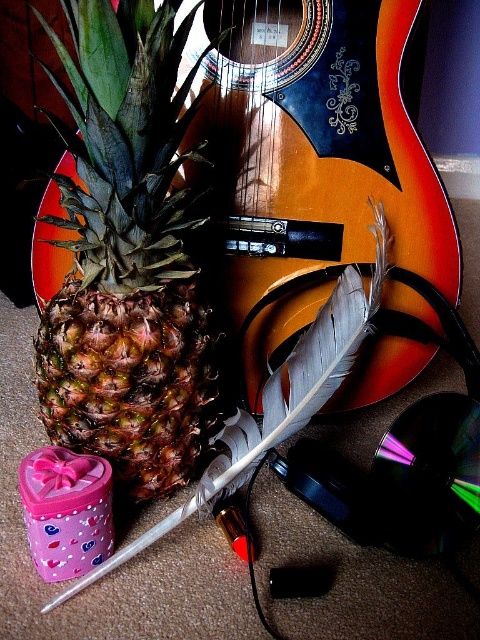
Question: Among these points, which one is farthest from the camera?

Choices:
 (A) (264, 378)
 (B) (162, 321)

Answer: (A)

Question: Which point is farther from the camera taking this photo?

Choices:
 (A) (108, 28)
 (B) (363, 257)

Answer: (B)

Question: Is glossy wood guitar at upper center to the right of brown rough pineapple at center from the viewer's perspective?

Choices:
 (A) yes
 (B) no

Answer: (A)

Question: Among these points, which one is farthest from the camera?

Choices:
 (A) (248, 156)
 (B) (163, 77)

Answer: (A)

Question: Is the position of glossy wood guitar at upper center less distant than that of brown rough pineapple at center?

Choices:
 (A) yes
 (B) no

Answer: (B)

Question: Where is glossy wood guitar at upper center located in relation to brown rough pineapple at center in the image?

Choices:
 (A) left
 (B) right

Answer: (B)